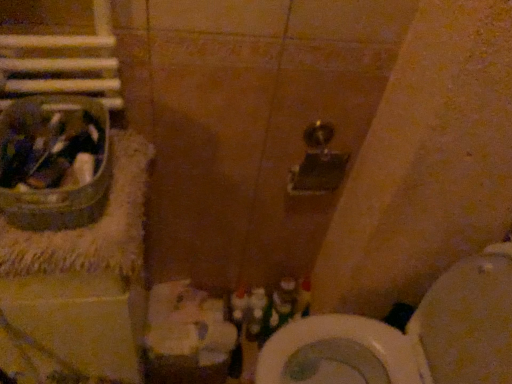
Question: From a real-world perspective, is white glossy toilet at lower right over metallic silver sink at left?

Choices:
 (A) no
 (B) yes

Answer: (A)

Question: Does white glossy toilet at lower right have a smaller size compared to metallic silver sink at left?

Choices:
 (A) no
 (B) yes

Answer: (A)

Question: Is the depth of white glossy toilet at lower right less than that of metallic silver sink at left?

Choices:
 (A) yes
 (B) no

Answer: (B)

Question: Are white glossy toilet at lower right and metallic silver sink at left located far from each other?

Choices:
 (A) no
 (B) yes

Answer: (A)

Question: Considering the relative sizes of white glossy toilet at lower right and metallic silver sink at left in the image provided, is white glossy toilet at lower right shorter than metallic silver sink at left?

Choices:
 (A) no
 (B) yes

Answer: (A)

Question: From the image's perspective, is white glossy toilet at lower right beneath metallic silver sink at left?

Choices:
 (A) no
 (B) yes

Answer: (B)

Question: Is metallic silver sink at left next to white glossy toilet at lower right?

Choices:
 (A) yes
 (B) no

Answer: (B)

Question: Is metallic silver sink at left surrounding white glossy toilet at lower right?

Choices:
 (A) yes
 (B) no

Answer: (B)

Question: From the image's perspective, is metallic silver sink at left below white glossy toilet at lower right?

Choices:
 (A) no
 (B) yes

Answer: (A)

Question: From a real-world perspective, is metallic silver sink at left below white glossy toilet at lower right?

Choices:
 (A) no
 (B) yes

Answer: (A)

Question: Is metallic silver sink at left not within white glossy toilet at lower right?

Choices:
 (A) yes
 (B) no

Answer: (A)

Question: Is metallic silver sink at left positioned behind white glossy toilet at lower right?

Choices:
 (A) yes
 (B) no

Answer: (B)

Question: In terms of width, does white glossy toilet at lower right look wider or thinner when compared to metallic silver sink at left?

Choices:
 (A) wide
 (B) thin

Answer: (A)